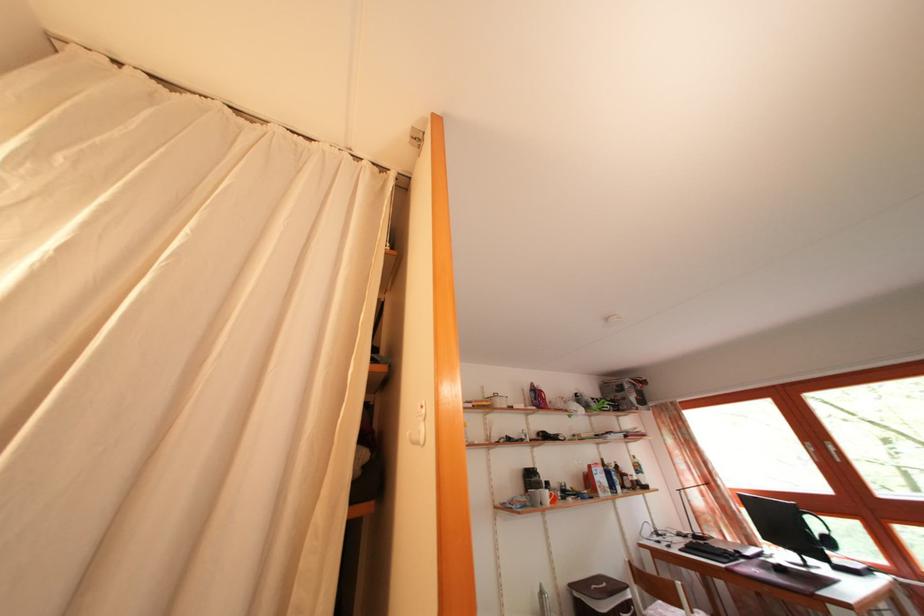
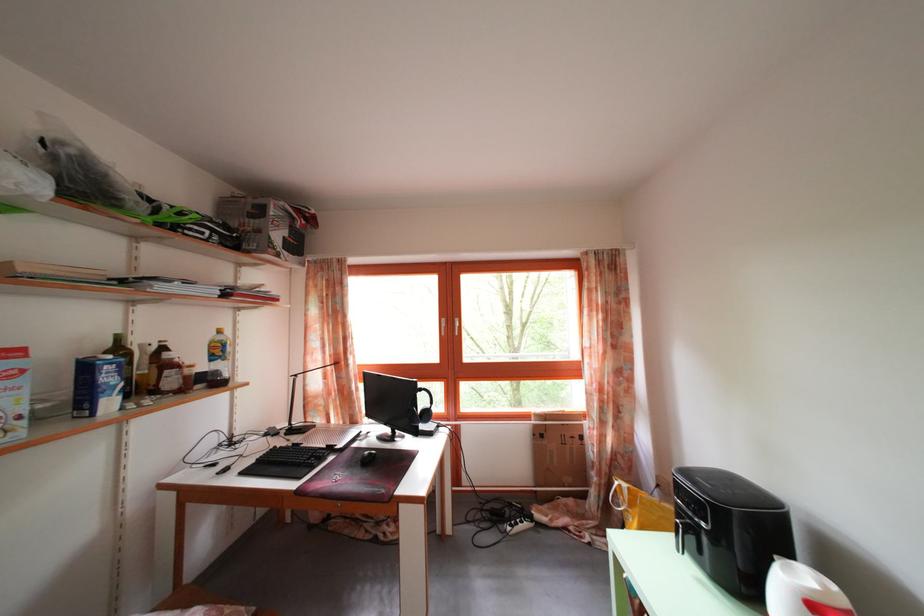
In the second image, find the point that corresponds to the point at 646,476 in the first image.

(225, 359)